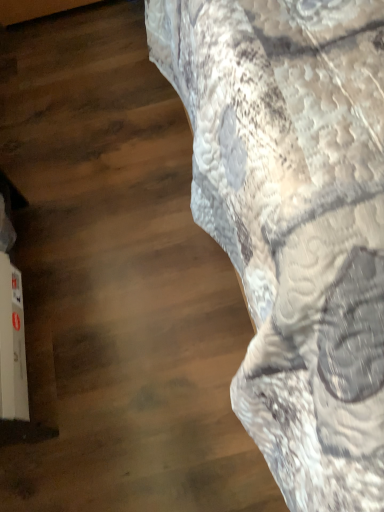
Locate an element on the screen. The image size is (384, 512). vacant area on top of textured fabric bedspread at upper right (from a real-world perspective) is located at coordinates (96, 197).